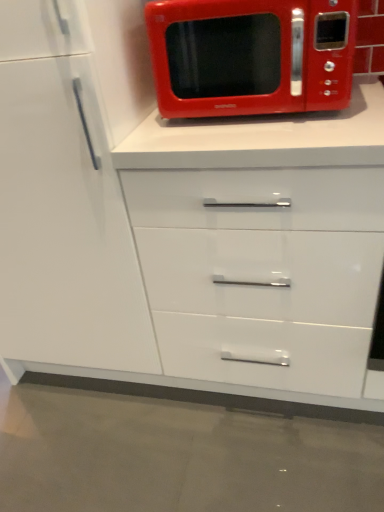
This screenshot has height=512, width=384. What do you see at coordinates (251, 56) in the screenshot? I see `shiny red microwave at upper center` at bounding box center [251, 56].

Locate an element on the screen. The image size is (384, 512). shiny red microwave at upper center is located at coordinates (251, 56).

Measure the distance between point (223, 100) and camera.

The distance of point (223, 100) from camera is 38.54 inches.

What is the approximate width of white glossy cabinet at lower left?

white glossy cabinet at lower left is 65.30 centimeters in width.

What do you see at coordinates (62, 204) in the screenshot? This screenshot has width=384, height=512. I see `white glossy cabinet at lower left` at bounding box center [62, 204].

Where is `white glossy cabinet at lower left`? The height and width of the screenshot is (512, 384). white glossy cabinet at lower left is located at coordinates (62, 204).

I want to click on shiny red microwave at upper center, so click(251, 56).

Which is more to the left, white glossy cabinet at lower left or shiny red microwave at upper center?

From the viewer's perspective, white glossy cabinet at lower left appears more on the left side.

Which object is further away from the camera, white glossy cabinet at lower left or shiny red microwave at upper center?

shiny red microwave at upper center is behind.

Considering the positions of point (50, 344) and point (220, 0), is point (50, 344) closer or farther from the camera than point (220, 0)?

Point (50, 344) is farther from the camera than point (220, 0).

From the image's perspective, does white glossy cabinet at lower left appear higher than shiny red microwave at upper center?

No, from the image's perspective, white glossy cabinet at lower left is not over shiny red microwave at upper center.

From a real-world perspective, which is physically above, white glossy cabinet at lower left or shiny red microwave at upper center?

In real-world perspective, shiny red microwave at upper center is above.

Considering the relative sizes of white glossy cabinet at lower left and shiny red microwave at upper center in the image provided, is white glossy cabinet at lower left thinner than shiny red microwave at upper center?

In fact, white glossy cabinet at lower left might be wider than shiny red microwave at upper center.

Looking at this image, in terms of height, does white glossy cabinet at lower left look taller or shorter compared to shiny red microwave at upper center?

Considering their sizes, white glossy cabinet at lower left has more height than shiny red microwave at upper center.

Considering the sizes of objects white glossy cabinet at lower left and shiny red microwave at upper center in the image provided, who is smaller, white glossy cabinet at lower left or shiny red microwave at upper center?

With smaller size is shiny red microwave at upper center.

Would you say white glossy cabinet at lower left is inside or outside shiny red microwave at upper center?

The correct answer is: outside.

Is white glossy cabinet at lower left beside shiny red microwave at upper center?

No, white glossy cabinet at lower left is not with shiny red microwave at upper center.

Is white glossy cabinet at lower left oriented away from shiny red microwave at upper center?

white glossy cabinet at lower left does not have its back to shiny red microwave at upper center.

Locate an element on the screen. The image size is (384, 512). cabinetry on the left of shiny red microwave at upper center is located at coordinates (62, 204).

Visually, is shiny red microwave at upper center positioned to the left or to the right of white glossy cabinet at lower left?

Clearly, shiny red microwave at upper center is on the right of white glossy cabinet at lower left in the image.

Is the depth of shiny red microwave at upper center less than that of white glossy cabinet at lower left?

No, the depth of shiny red microwave at upper center is greater than that of white glossy cabinet at lower left.

Considering the positions of point (344, 16) and point (21, 173), is point (344, 16) closer or farther from the camera than point (21, 173)?

Clearly, point (344, 16) is closer to the camera than point (21, 173).

From the image's perspective, which is above, shiny red microwave at upper center or white glossy cabinet at lower left?

shiny red microwave at upper center is shown above in the image.

From a real-world perspective, which object stands above the other?

In real-world perspective, shiny red microwave at upper center is above.

Based on the photo, which of these two, shiny red microwave at upper center or white glossy cabinet at lower left, is wider?

white glossy cabinet at lower left is wider.

Who is taller, shiny red microwave at upper center or white glossy cabinet at lower left?

white glossy cabinet at lower left.

Based on their sizes in the image, would you say shiny red microwave at upper center is bigger or smaller than white glossy cabinet at lower left?

shiny red microwave at upper center is smaller than white glossy cabinet at lower left.

From the picture: Is white glossy cabinet at lower left surrounded by shiny red microwave at upper center?

No, white glossy cabinet at lower left is not surrounded by shiny red microwave at upper center.

Is shiny red microwave at upper center touching white glossy cabinet at lower left?

No.

Is shiny red microwave at upper center turned away from white glossy cabinet at lower left?

No, shiny red microwave at upper center is not facing away from white glossy cabinet at lower left.

Looking at this image, can you tell me how much shiny red microwave at upper center and white glossy cabinet at lower left differ in facing direction?

0.00109 degrees.

Measure the distance between shiny red microwave at upper center and white glossy cabinet at lower left.

They are 14.97 inches apart.

Locate an element on the screen. microwave oven lying behind the white glossy cabinet at lower left is located at coordinates (251, 56).

Identify the location of microwave oven above the white glossy cabinet at lower left (from the image's perspective). This screenshot has width=384, height=512. (251, 56).

At what (x,y) coordinates should I click in order to perform the action: click on cabinetry on the left of shiny red microwave at upper center. Please return your answer as a coordinate pair (x, y). The image size is (384, 512). Looking at the image, I should click on pyautogui.click(x=62, y=204).